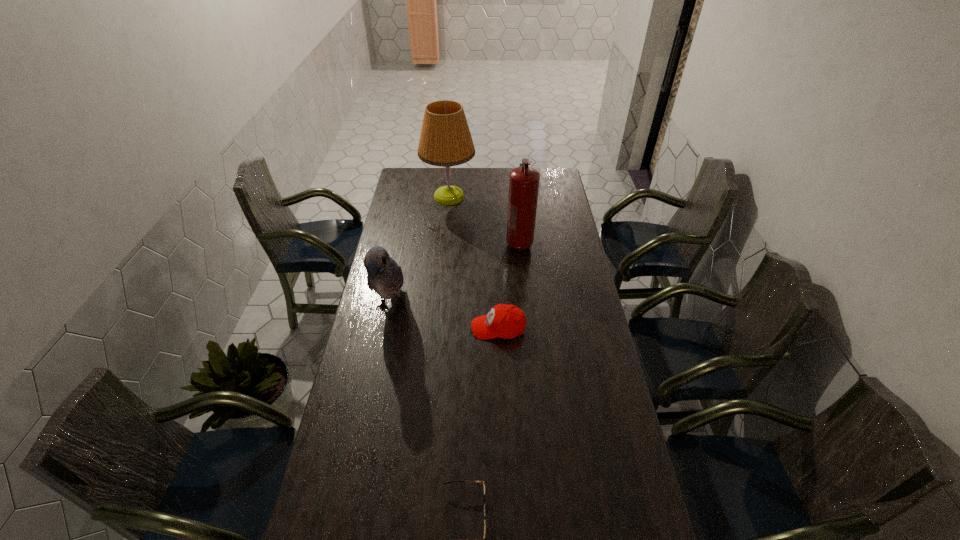
Where is `object that is at the far edge`? object that is at the far edge is located at coordinates (445, 140).

Locate an element on the screen. This screenshot has width=960, height=540. lamp positioned at the left edge is located at coordinates (445, 140).

Find the location of a particular element. The width and height of the screenshot is (960, 540). parrot located at the left edge is located at coordinates (385, 277).

In order to click on object located in the far left corner section of the desktop in this screenshot , I will do `click(445, 140)`.

Find the location of a particular element. vacant area at the far edge is located at coordinates (486, 169).

Where is `vacant space at the left edge of the desktop`? vacant space at the left edge of the desktop is located at coordinates (358, 406).

Identify the location of vacant area at the right edge. This screenshot has height=540, width=960. (555, 271).

The width and height of the screenshot is (960, 540). In order to click on unoccupied area between the fourth tallest object and the lamp in this screenshot , I will do `click(473, 262)`.

The width and height of the screenshot is (960, 540). Find the location of `free point between the parrot and the second shortest object`. free point between the parrot and the second shortest object is located at coordinates (444, 318).

Where is `empty location between the baseball cap and the parrot`? The height and width of the screenshot is (540, 960). empty location between the baseball cap and the parrot is located at coordinates (444, 318).